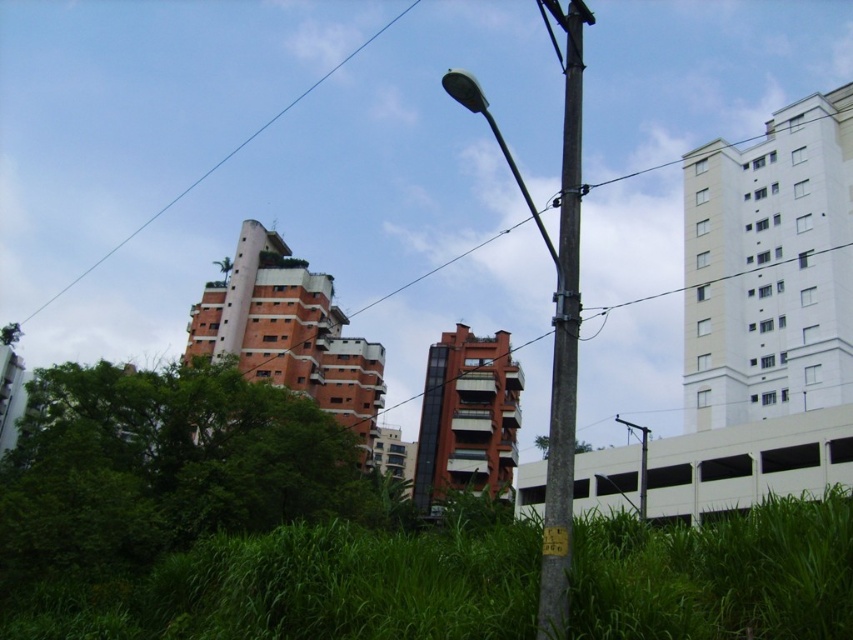
Question: Is green grass at lower center wider than metallic gray pole at center?

Choices:
 (A) no
 (B) yes

Answer: (A)

Question: Estimate the real-world distances between objects in this image. Which object is closer to the metallic gray pole at center?

Choices:
 (A) metallic pole at center
 (B) blue wire at upper left

Answer: (A)

Question: Which object is positioned farthest from the metallic gray pole at center?

Choices:
 (A) green grass at lower center
 (B) metallic pole at center
 (C) brown wooden telegraph pole at center

Answer: (B)

Question: Which is nearer to the blue wire at upper left?

Choices:
 (A) green grass at lower center
 (B) yellow plastic street sign at lower center
 (C) metallic gray pole at center

Answer: (C)

Question: Is green grass at lower center positioned behind yellow plastic street sign at lower center?

Choices:
 (A) no
 (B) yes

Answer: (A)

Question: Can you confirm if metallic gray pole at center is positioned to the right of blue wire at upper left?

Choices:
 (A) no
 (B) yes

Answer: (B)